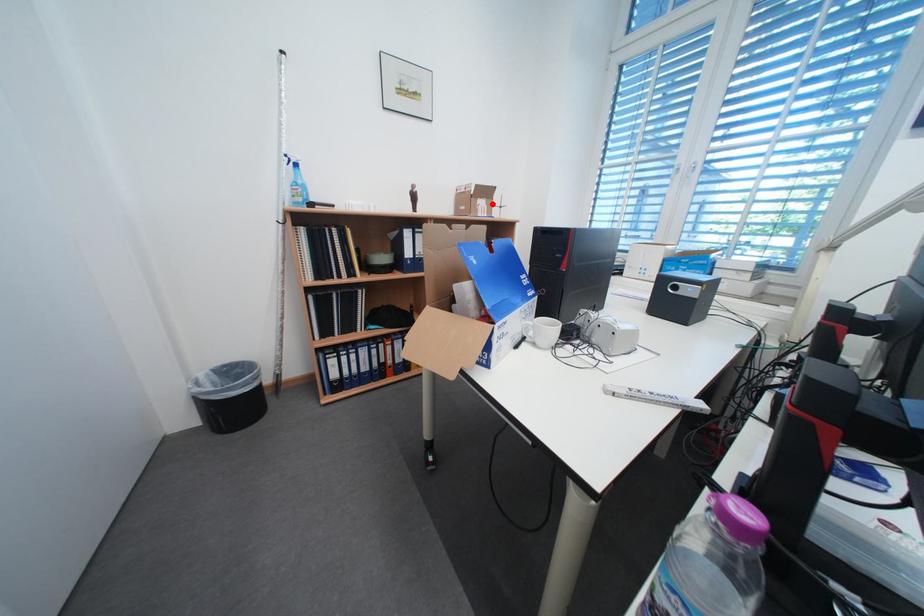
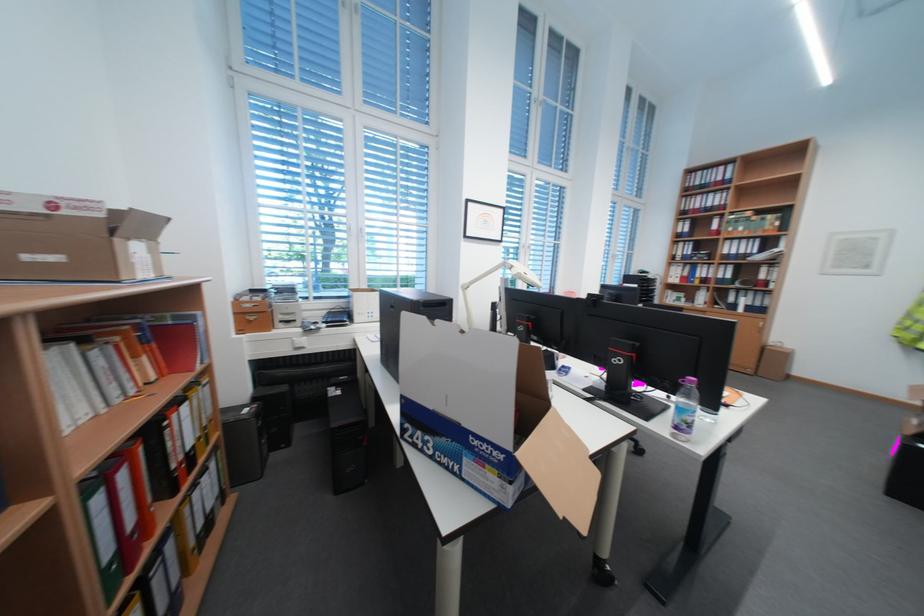
Question: I am providing you with two images of the same scene from different viewpoints. A red point is marked on the first image. Can you still see the location of the red point in image 2?

Choices:
 (A) Yes
 (B) No

Answer: (A)